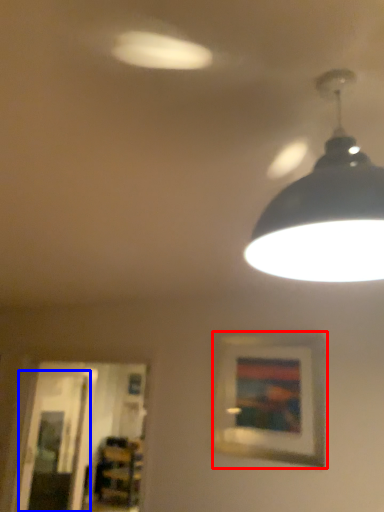
Question: Which object appears farthest to the camera in this image, picture frame (highlighted by a red box) or glass door (highlighted by a blue box)?

Choices:
 (A) picture frame
 (B) glass door

Answer: (B)